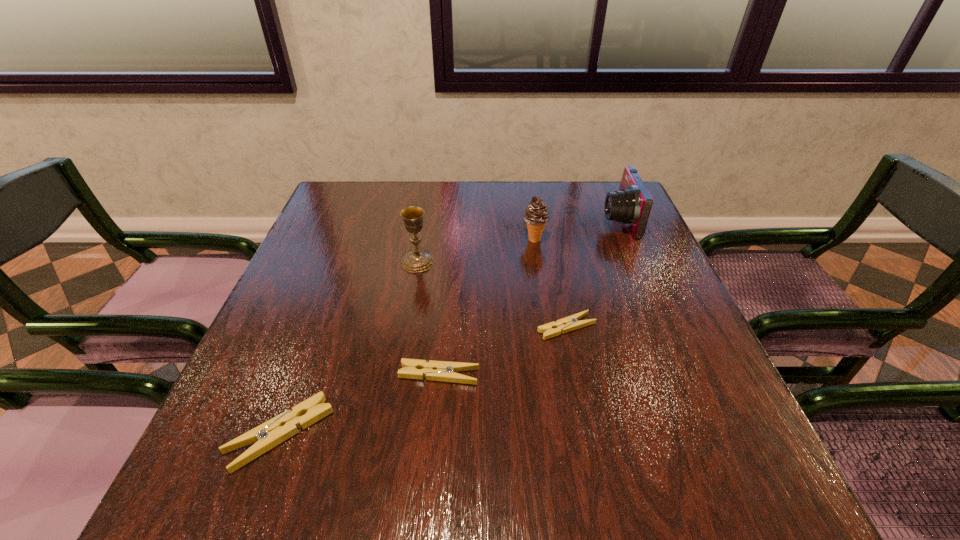
What are the coordinates of `vacant point located between the leftmost clothespin and the icecream` in the screenshot? It's located at (407, 336).

This screenshot has width=960, height=540. I want to click on vacant area that lies between the nearest clothespin and the fourth nearest object, so click(x=349, y=348).

In order to click on free point between the icecream and the third farthest object in this screenshot , I will do `click(476, 251)`.

The height and width of the screenshot is (540, 960). What are the coordinates of `free space between the icecream and the fourth nearest object` in the screenshot? It's located at click(476, 251).

Locate an element on the screen. The height and width of the screenshot is (540, 960). vacant space that is in between the second nearest object and the icecream is located at coordinates (487, 307).

I want to click on free space between the shortest clothespin and the fifth farthest object, so click(503, 351).

Where is `vacant space that's between the leftmost clothespin and the second clothespin from left to right`? The image size is (960, 540). vacant space that's between the leftmost clothespin and the second clothespin from left to right is located at coordinates (360, 404).

I want to click on free space between the icecream and the shortest clothespin, so click(x=550, y=284).

The height and width of the screenshot is (540, 960). Find the location of `free area in between the shortest object and the chalice`. free area in between the shortest object and the chalice is located at coordinates (492, 295).

Locate an element on the screen. free space between the third farthest object and the leftmost object is located at coordinates click(x=349, y=348).